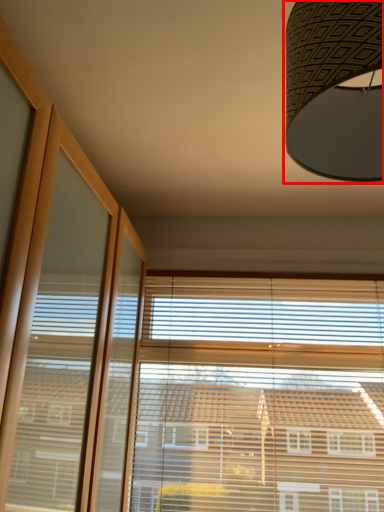
Question: From the image's perspective, where is lamp (annotated by the red box) located relative to bay window?

Choices:
 (A) above
 (B) below

Answer: (A)